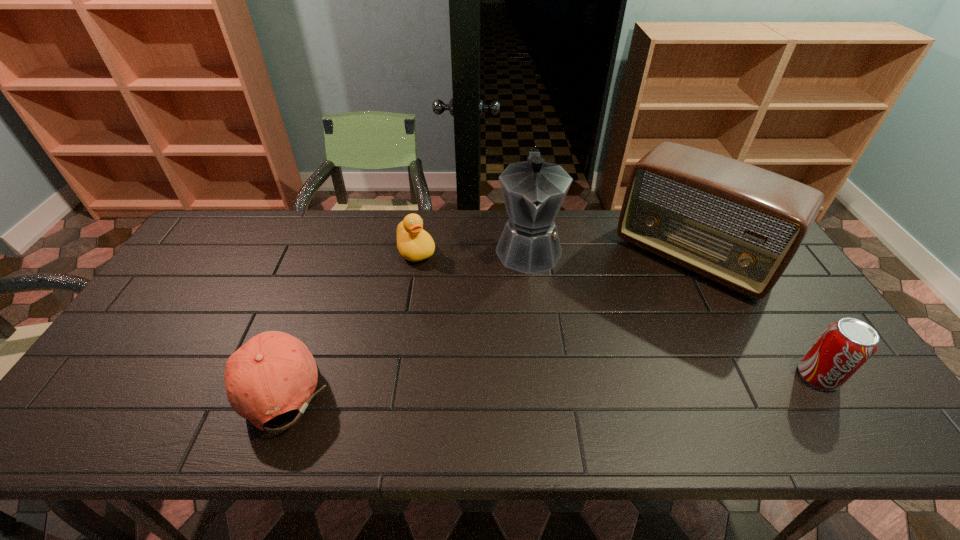
Where is `free space on the desktop that is between the baseball cap and the soda can and is positioned at the spout of the third object from right to left`? The width and height of the screenshot is (960, 540). free space on the desktop that is between the baseball cap and the soda can and is positioned at the spout of the third object from right to left is located at coordinates (533, 380).

Locate an element on the screen. The image size is (960, 540). free space on the desktop that is between the baseball cap and the soda can and is positioned on the front-facing side of the radio receiver is located at coordinates (597, 379).

You are a GUI agent. You are given a task and a screenshot of the screen. Output one action in this format:
    pyautogui.click(x=<x>, y=<y>)
    Task: Click on the vacant space on the desktop that is between the leftmost object and the soda can and is positioned on the face of the second object from left to right
    Image resolution: width=960 pixels, height=540 pixels.
    Given the screenshot: What is the action you would take?
    [x=492, y=380]